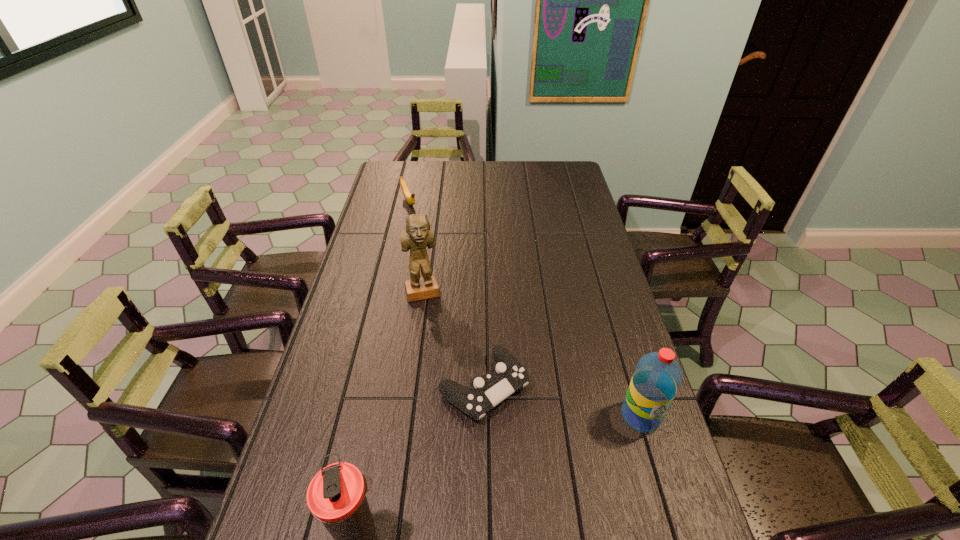
In order to click on vacant space located 0.390m on the front-facing side of the figurine in this screenshot , I will do `click(456, 403)`.

This screenshot has width=960, height=540. Find the location of `free space located on the front-facing side of the figurine`. free space located on the front-facing side of the figurine is located at coordinates (451, 384).

You are a GUI agent. You are given a task and a screenshot of the screen. Output one action in this format:
    pyautogui.click(x=<x>, y=<y>)
    Task: Click on the free spot located on the surface of the control
    
    Given the screenshot: What is the action you would take?
    pyautogui.click(x=536, y=440)

In order to click on free space located 0.270m on the surface of the control in this screenshot , I will do `click(595, 502)`.

You are a GUI agent. You are given a task and a screenshot of the screen. Output one action in this format:
    pyautogui.click(x=<x>, y=<y>)
    Task: Click on the vacant space located on the surface of the control
    The width and height of the screenshot is (960, 540).
    Given the screenshot: What is the action you would take?
    pyautogui.click(x=621, y=529)

Identify the location of object at the left edge. (410, 198).

Where is `object that is at the right edge`? object that is at the right edge is located at coordinates (657, 377).

You are a GUI agent. You are given a task and a screenshot of the screen. Output one action in this format:
    pyautogui.click(x=<x>, y=<y>)
    Task: Click on the free region at the far edge of the desktop
    This screenshot has width=960, height=540.
    Given the screenshot: What is the action you would take?
    pos(500,167)

Image resolution: width=960 pixels, height=540 pixels. Identify the location of vacant space at the left edge of the desktop. (296, 446).

In the image, there is a desktop. Identify the location of vacant space at the right edge. (552, 196).